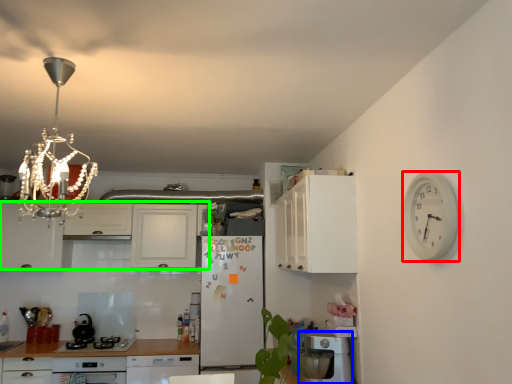
Question: Which object is positioned closest to clock (highlighted by a red box)? Select from dish washer (highlighted by a blue box) and cabinetry (highlighted by a green box).

Choices:
 (A) dish washer
 (B) cabinetry

Answer: (A)